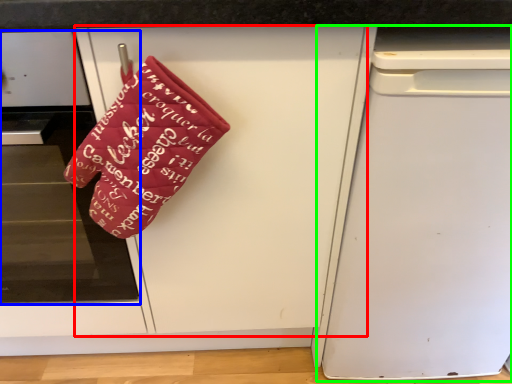
Question: Estimate the real-world distances between objects in this image. Which object is closer to door (highlighted by a red box), home appliance (highlighted by a blue box) or dish washer (highlighted by a green box)?

Choices:
 (A) home appliance
 (B) dish washer

Answer: (B)